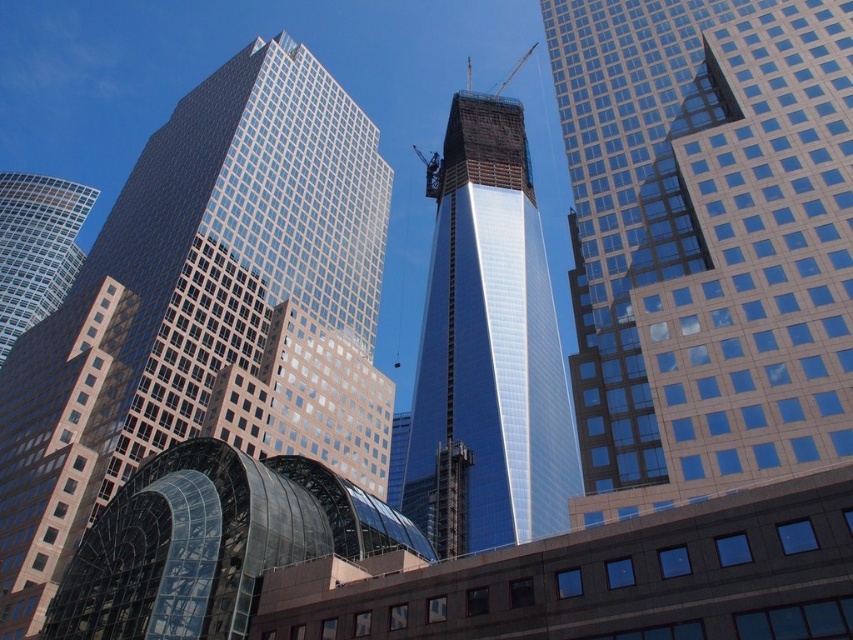
Which is in front, point (840, 44) or point (136, 394)?

Point (840, 44)

Between point (619, 413) and point (260, 316), which one is positioned in front?

Point (619, 413)

Identify the location of glassy steel skyscraper at center. The height and width of the screenshot is (640, 853). (708, 241).

Consider the image. Can you confirm if glassy reflective skyscraper at center is positioned below matte glass skyscraper at left?

Correct, glassy reflective skyscraper at center is located below matte glass skyscraper at left.

Which is behind, point (280, 44) or point (62, 262)?

Positioned behind is point (62, 262).

Which is behind, point (368, 237) or point (4, 232)?

Point (4, 232)

Identify the location of glassy reflective skyscraper at center. Image resolution: width=853 pixels, height=640 pixels. (189, 300).

Who is lower down, glassy reflective skyscraper at center or shiny glass skyscraper at center?

glassy reflective skyscraper at center is lower down.

Can you confirm if glassy reflective skyscraper at center is smaller than shiny glass skyscraper at center?

Yes.

Where is `glassy reflective skyscraper at center`? glassy reflective skyscraper at center is located at coordinates (189, 300).